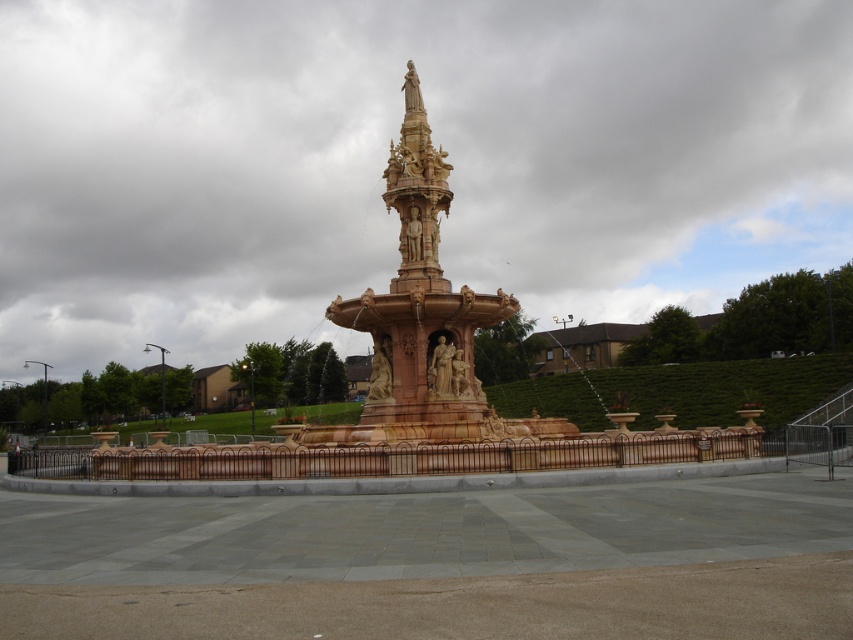
You are standing at the center of the public square and see two points marked in the image. The first point is labeled as point (230, 452) and the second is point (398, 170). Which of these two points is closer to you?

Point (230, 452) is in front of point (398, 170), so it is closer to you.

You are standing in the public square and want to take a photo of both the polished stone fountain at center and the golden stone spire at center. Based on their positioning, which one should you focus on first to ensure both are in the frame?

The polished stone fountain at center is in front of the golden stone spire at center, so you should focus on the golden stone spire at center first to ensure both are visible in the frame.

You are standing in the public square and see the polished stone fountain at center and the golden stone spire at center. Which one is positioned to the left?

The polished stone fountain at center is positioned to the left of the golden stone spire at center.